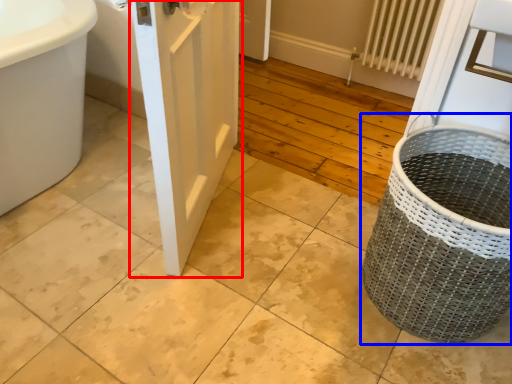
Question: Which point is closer to the camera, door (highlighted by a red box) or basket container (highlighted by a blue box)?

Choices:
 (A) door
 (B) basket container

Answer: (A)